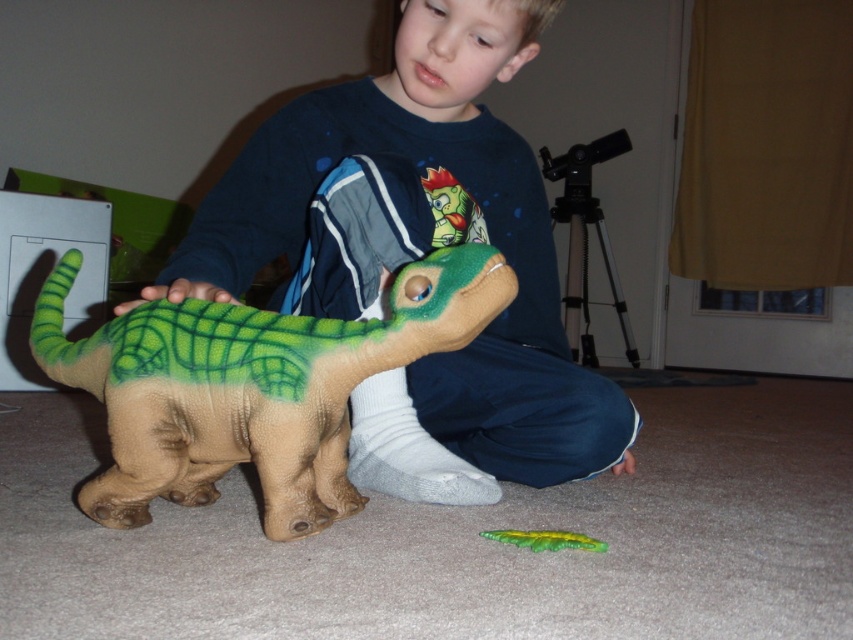
You are a parent organizing toys in the room. You need to place both the soft plush dinosaur at center and the green matte dinosaur at lower left on a shelf that can only hold items up to 18 inches tall. Which dinosaur should you place first to ensure both fit?

The soft plush dinosaur at center is taller than the green matte dinosaur at lower left. To ensure both fit on the shelf, place the shorter green matte dinosaur at lower left first, then the taller one, but since the shelf has a height limit, you need to check if the tallest item, the soft plush dinosaur at center, is under 18 inches. If it is, both can be placed.

You are a parent trying to arrange toys for a play area. You have the soft plush dinosaur at center and the green matte toy at lower center. If you want to place them exactly 20 inches apart, can you achieve this by moving only one of them?

The soft plush dinosaur at center is currently 18.17 inches away from the green matte toy at lower center. To reach the desired 20 inches, you can move either the soft plush dinosaur at center or the green matte toy at lower center by approximately 1.83 inches in the opposite direction from each other.

You are a photographer taking a picture of the scene. You need to focus on the point that is closer to the camera. Which point should you choose between point (x=314, y=474) and point (x=544, y=547)?

Point (x=544, y=547) is closer to the camera than point (x=314, y=474), so you should focus on point (x=544, y=547).